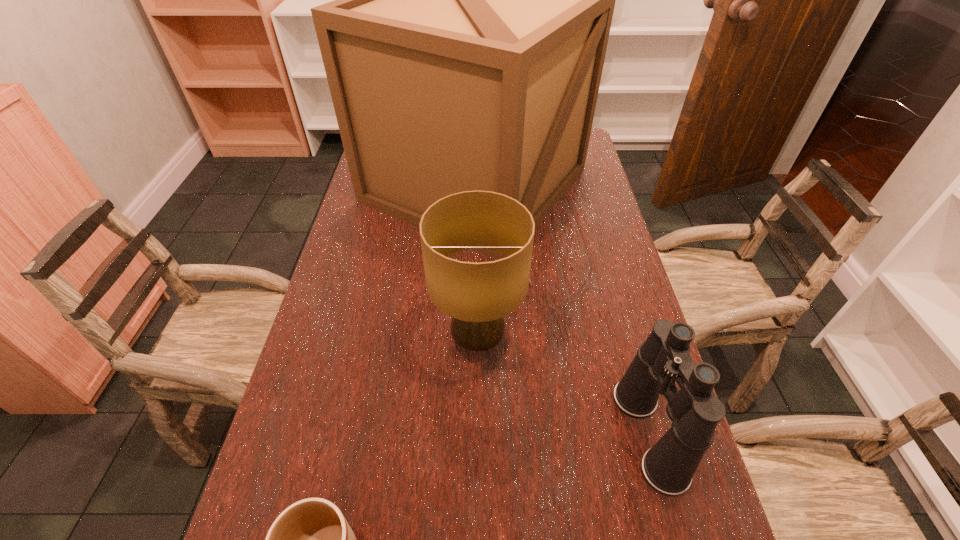
Image resolution: width=960 pixels, height=540 pixels. I want to click on object that is at the left edge, so click(473, 0).

Find the location of `box that is at the right edge`. box that is at the right edge is located at coordinates (473, 0).

Where is `binoculars that is positioned at the right edge`? The height and width of the screenshot is (540, 960). binoculars that is positioned at the right edge is located at coordinates (664, 358).

You are a GUI agent. You are given a task and a screenshot of the screen. Output one action in this format:
    pyautogui.click(x=<x>, y=<y>)
    Task: Click on the object that is at the far left corner
    
    Given the screenshot: What is the action you would take?
    (473, 0)

Locate an element on the screen. The image size is (960, 540). object that is at the far right corner is located at coordinates (473, 0).

This screenshot has height=540, width=960. Find the location of `vacant space at the left edge of the desktop`. vacant space at the left edge of the desktop is located at coordinates (376, 219).

I want to click on vacant region at the right edge, so click(628, 318).

This screenshot has width=960, height=540. What are the coordinates of `vacant space that is in between the binoculars and the tallest object` in the screenshot? It's located at (562, 309).

In order to click on free spot between the farthest object and the binoculars in this screenshot , I will do `click(562, 309)`.

Identify which object is located as the nearest to the third farthest object. Please provide its 2D coordinates. Your answer should be formatted as a tuple, i.e. [(x, y)], where the tuple contains the x and y coordinates of a point satisfying the conditions above.

[(477, 296)]